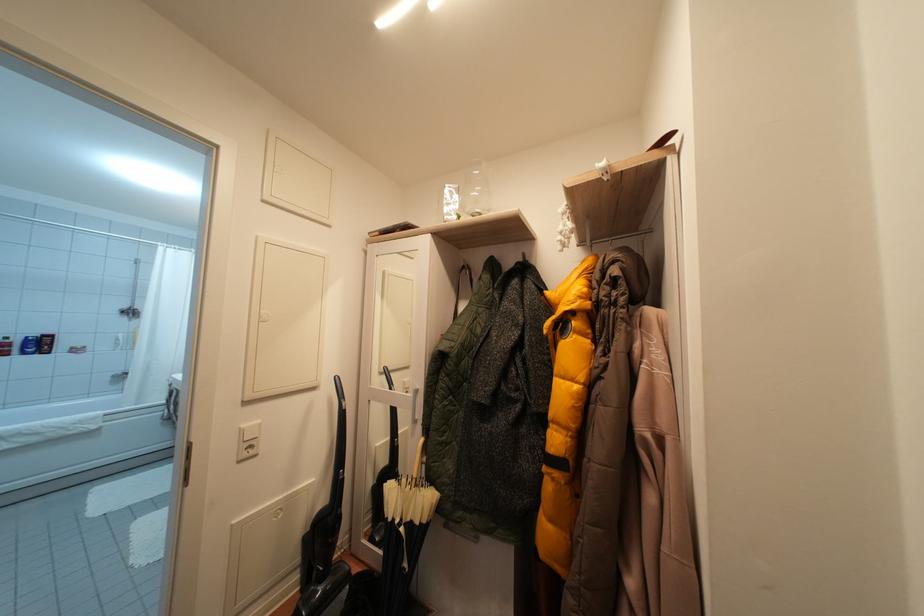
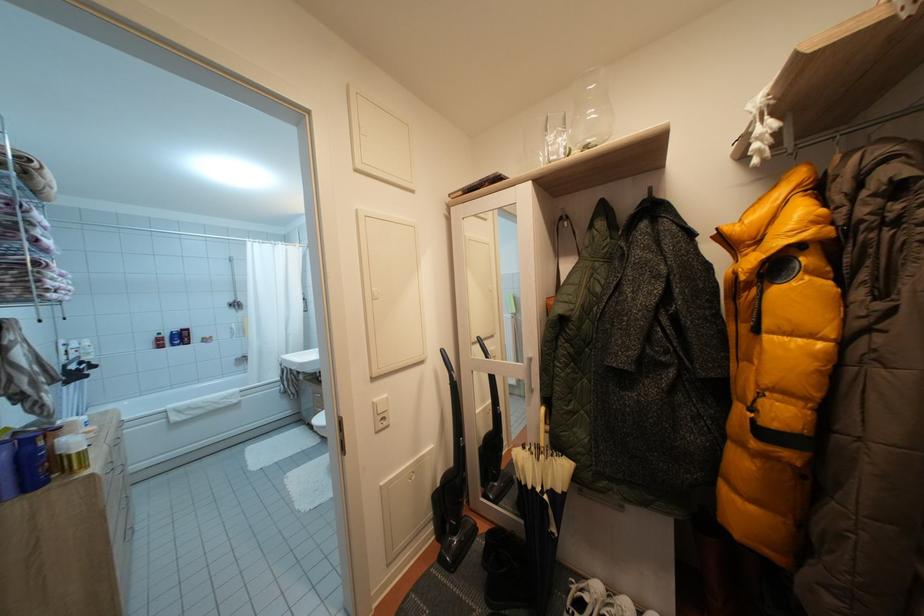
Question: The images are taken continuously from a first-person perspective. In which direction are you moving?

Choices:
 (A) Left
 (B) Right
 (C) Forward
 (D) Backward

Answer: (A)